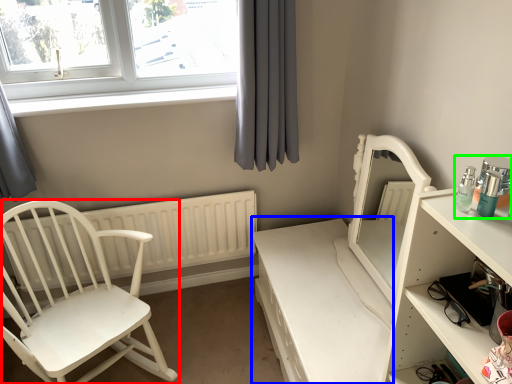
Question: Estimate the real-world distances between objects in this image. Which object is closer to chair (highlighted by a red box), vanity (highlighted by a blue box) or toiletry (highlighted by a green box)?

Choices:
 (A) vanity
 (B) toiletry

Answer: (A)